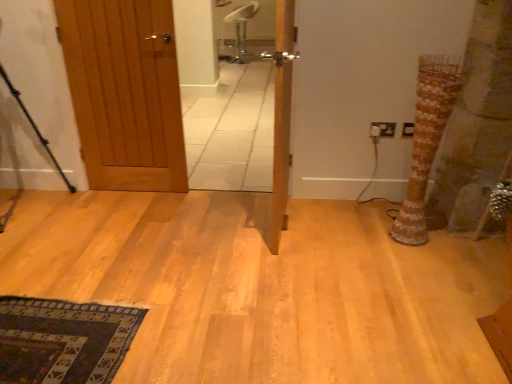
What do you see at coordinates (241, 29) in the screenshot? I see `white plastic chair at upper center` at bounding box center [241, 29].

Measure the distance between wooden door at left, marked as the second door in a right-to-left arrangement, and camera.

wooden door at left, marked as the second door in a right-to-left arrangement, is 2.35 meters from camera.

What is the approximate height of wooden door at center, which is counted as the second door, starting from the left?

wooden door at center, which is counted as the second door, starting from the left, is 1.22 meters in height.

What do you see at coordinates (382, 129) in the screenshot? I see `white plastic electric outlet at right, the first electric outlet viewed from the left` at bounding box center [382, 129].

Where is `striped fabric tree trunk at right`? The width and height of the screenshot is (512, 384). striped fabric tree trunk at right is located at coordinates (426, 141).

Find the location of a particular element. white plastic chair at upper center is located at coordinates (241, 29).

Is point (387, 122) closer to camera compared to point (137, 43)?

That is False.

Can you confirm if white plastic electric outlet at right, the second electric outlet viewed from the right, is thinner than wooden door at left, marked as the second door in a right-to-left arrangement?

Yes.

From a real-world perspective, who is located lower, black metal tripod at left or striped fabric tree trunk at right?

In real-world perspective, striped fabric tree trunk at right is lower.

Is striped fabric tree trunk at right a part of black metal tripod at left?

No, striped fabric tree trunk at right is located outside of black metal tripod at left.

How far apart are black metal tripod at left and striped fabric tree trunk at right?

black metal tripod at left is 7.39 feet away from striped fabric tree trunk at right.

Which point is more distant from viewer, (53, 160) or (430, 97)?

The point (53, 160) is farther.

Does black metal tripod at left have a larger size compared to white plastic electric outlet at upper right, positioned as the first electric outlet in right-to-left order?

Correct, black metal tripod at left is larger in size than white plastic electric outlet at upper right, positioned as the first electric outlet in right-to-left order.

Can you confirm if black metal tripod at left is positioned to the right of white plastic electric outlet at upper right, which appears as the second electric outlet when viewed from the left?

Incorrect, black metal tripod at left is not on the right side of white plastic electric outlet at upper right, which appears as the second electric outlet when viewed from the left.

Does black metal tripod at left have a greater width compared to white plastic electric outlet at upper right, positioned as the first electric outlet in right-to-left order?

Correct, the width of black metal tripod at left exceeds that of white plastic electric outlet at upper right, positioned as the first electric outlet in right-to-left order.

Between wooden door at center, which is counted as the 1th door, starting from the right, and wooden door at left, the 1th door viewed from the left, which one has smaller size?

With smaller size is wooden door at left, the 1th door viewed from the left.

From a real-world perspective, is wooden door at center, which is counted as the second door, starting from the left, physically below wooden door at left, marked as the second door in a right-to-left arrangement?

No.

Is wooden door at center, which is counted as the 1th door, starting from the right, looking in the opposite direction of wooden door at left, marked as the second door in a right-to-left arrangement?

No, wooden door at center, which is counted as the 1th door, starting from the right, is not facing the opposite direction of wooden door at left, marked as the second door in a right-to-left arrangement.

This screenshot has height=384, width=512. I want to click on door that appears above the wooden door at left, the 1th door viewed from the left (from a real-world perspective), so click(281, 118).

Which is in front, point (123, 170) or point (372, 134)?

Point (372, 134)

Does wooden door at left, marked as the second door in a right-to-left arrangement, come behind white plastic electric outlet at right, the second electric outlet viewed from the right?

No, wooden door at left, marked as the second door in a right-to-left arrangement, is in front of white plastic electric outlet at right, the second electric outlet viewed from the right.

Does wooden door at left, marked as the second door in a right-to-left arrangement, touch white plastic electric outlet at right, the second electric outlet viewed from the right?

No, wooden door at left, marked as the second door in a right-to-left arrangement, is not making contact with white plastic electric outlet at right, the second electric outlet viewed from the right.

Is wooden door at left, the 1th door viewed from the left, situated inside white plastic electric outlet at right, the first electric outlet viewed from the left, or outside?

wooden door at left, the 1th door viewed from the left, is located beyond the bounds of white plastic electric outlet at right, the first electric outlet viewed from the left.

Is point (80, 92) positioned after point (13, 89)?

No, (80, 92) is in front of (13, 89).

Does wooden door at left, marked as the second door in a right-to-left arrangement, have a larger size compared to black metal tripod at left?

Incorrect, wooden door at left, marked as the second door in a right-to-left arrangement, is not larger than black metal tripod at left.

How much distance is there between wooden door at left, the 1th door viewed from the left, and black metal tripod at left?

59.88 centimeters.

You are a GUI agent. You are given a task and a screenshot of the screen. Output one action in this format:
    pyautogui.click(x=<x>, y=<y>)
    Task: Click on the tripod on the left of white plastic chair at upper center
    This screenshot has width=512, height=384.
    Given the screenshot: What is the action you would take?
    pyautogui.click(x=35, y=128)

Based on the photo, is black metal tripod at left taller than white plastic chair at upper center?

Yes, black metal tripod at left is taller than white plastic chair at upper center.

Considering the points (52, 160) and (240, 33), which point is behind, point (52, 160) or point (240, 33)?

The point (240, 33) is farther.

Consider the image. From the image's perspective, is black metal tripod at left on white plastic chair at upper center?

No.

At what (x,y) coordinates should I click in order to perform the action: click on electric outlet that is the 1st object located below the wooden door at left, marked as the second door in a right-to-left arrangement (from the image's perspective). Please return your answer as a coordinate pair (x, y). Image resolution: width=512 pixels, height=384 pixels. Looking at the image, I should click on (382, 129).

Locate an element on the screen. tripod that appears behind the striped fabric tree trunk at right is located at coordinates (35, 128).

From the image, which object appears to be farther from white plastic electric outlet at right, the first electric outlet viewed from the left, wooden door at center, which is counted as the 1th door, starting from the right, or white plastic chair at upper center?

Among the two, white plastic chair at upper center is located further to white plastic electric outlet at right, the first electric outlet viewed from the left.

Based on their spatial positions, is striped fabric tree trunk at right or white plastic electric outlet at right, the first electric outlet viewed from the left, closer to white plastic chair at upper center?

Among the two, white plastic electric outlet at right, the first electric outlet viewed from the left, is located nearer to white plastic chair at upper center.

Looking at the image, which one is located closer to wooden door at left, marked as the second door in a right-to-left arrangement, white plastic chair at upper center or wooden door at center, which is counted as the second door, starting from the left?

wooden door at center, which is counted as the second door, starting from the left, is closer to wooden door at left, marked as the second door in a right-to-left arrangement.

From the image, which object appears to be farther from wooden door at center, which is counted as the 1th door, starting from the right, black metal tripod at left or white plastic electric outlet at right, the second electric outlet viewed from the right?

Based on the image, black metal tripod at left appears to be further to wooden door at center, which is counted as the 1th door, starting from the right.

Which object lies nearer to the anchor point black metal tripod at left, wooden door at left, marked as the second door in a right-to-left arrangement, or white plastic electric outlet at right, the first electric outlet viewed from the left?

wooden door at left, marked as the second door in a right-to-left arrangement, is positioned closer to the anchor black metal tripod at left.

Considering their positions, is white plastic chair at upper center positioned further to striped fabric tree trunk at right than wooden door at center, which is counted as the second door, starting from the left?

white plastic chair at upper center is further to striped fabric tree trunk at right.

When comparing their distances from striped fabric tree trunk at right, does white plastic electric outlet at upper right, which appears as the second electric outlet when viewed from the left, or white plastic chair at upper center seem closer?

white plastic electric outlet at upper right, which appears as the second electric outlet when viewed from the left, is positioned closer to the anchor striped fabric tree trunk at right.

From the image, which object appears to be farther from white plastic chair at upper center, white plastic electric outlet at right, the second electric outlet viewed from the right, or white plastic electric outlet at upper right, positioned as the first electric outlet in right-to-left order?

The object further to white plastic chair at upper center is white plastic electric outlet at upper right, positioned as the first electric outlet in right-to-left order.

Locate an element on the screen. The width and height of the screenshot is (512, 384). electric outlet between white plastic electric outlet at upper right, which appears as the second electric outlet when viewed from the left, and white plastic chair at upper center in the front-back direction is located at coordinates (382, 129).

At what (x,y) coordinates should I click in order to perform the action: click on electric outlet between black metal tripod at left and white plastic electric outlet at upper right, which appears as the second electric outlet when viewed from the left, from left to right. Please return your answer as a coordinate pair (x, y). Looking at the image, I should click on (382, 129).

This screenshot has height=384, width=512. In order to click on tree trunk between black metal tripod at left and white plastic electric outlet at upper right, positioned as the first electric outlet in right-to-left order in this screenshot , I will do `click(426, 141)`.

Find the location of `electric outlet positioned between wooden door at center, which is counted as the second door, starting from the left, and white plastic electric outlet at right, the second electric outlet viewed from the right, from near to far`. electric outlet positioned between wooden door at center, which is counted as the second door, starting from the left, and white plastic electric outlet at right, the second electric outlet viewed from the right, from near to far is located at coordinates tap(408, 129).